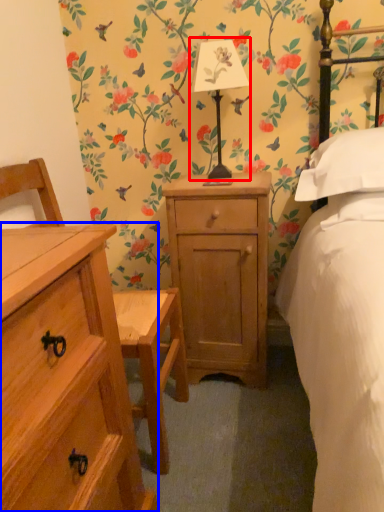
Question: Which object appears closest to the camera in this image, bedside lamp (highlighted by a red box) or chest of drawers (highlighted by a blue box)?

Choices:
 (A) bedside lamp
 (B) chest of drawers

Answer: (B)